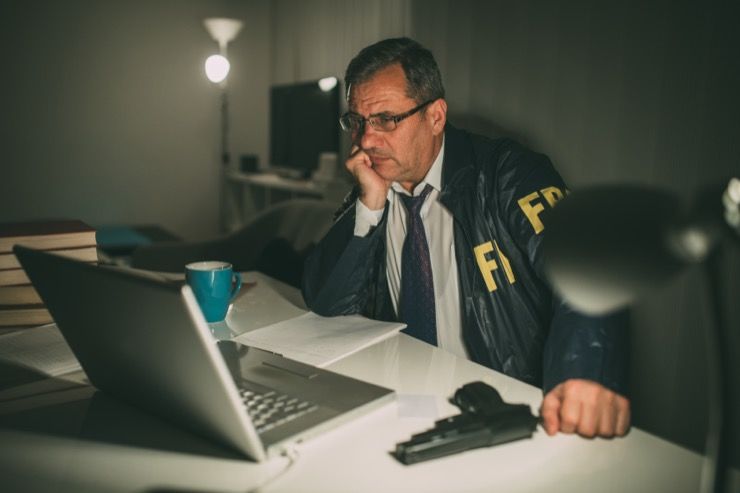
Find the location of a particular element. This screenshot has height=493, width=740. the back of laptop screen is located at coordinates (154, 355).